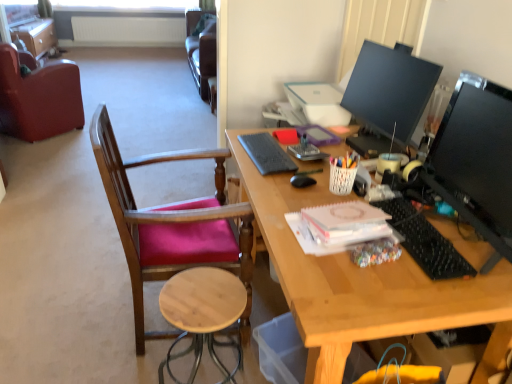
What do you see at coordinates (425, 242) in the screenshot?
I see `black plastic keyboard at right` at bounding box center [425, 242].

Measure the distance between point (409, 241) and camera.

The depth of point (409, 241) is 1.30 meters.

What is the approximate height of wooden chair with pink cushion at left, marked as the 1th chair in a bottom-to-top arrangement?

38.10 inches.

This screenshot has width=512, height=384. I want to click on wooden chair with pink cushion at left, which is counted as the second chair, starting from the left, so click(x=172, y=226).

In order to face black matte mouse at center, should I rotate leftwards or rightwards?

You should look right and rotate roughly 6.553 degrees.

What are the coordinates of `matte brown file cabinet at upper left` in the screenshot? It's located at (36, 36).

This screenshot has height=384, width=512. What do you see at coordinates (346, 223) in the screenshot?
I see `pink paper notepad at center, which ranks as the 2th notepad in top-to-bottom order` at bounding box center [346, 223].

Where is `black plastic keyboard at right`? The height and width of the screenshot is (384, 512). black plastic keyboard at right is located at coordinates (425, 242).

Which object is positioned more to the left, gray matte keyboard at center, the first notepad in the top-to-bottom sequence, or leather at left, marked as the second chair in a bottom-to-top arrangement?

leather at left, marked as the second chair in a bottom-to-top arrangement.

How many degrees apart are the facing directions of gray matte keyboard at center, which appears as the second notepad when ordered from the bottom, and leather at left, which is the 1th chair in top-to-bottom order?

The angular difference between gray matte keyboard at center, which appears as the second notepad when ordered from the bottom, and leather at left, which is the 1th chair in top-to-bottom order, is 137 degrees.

Which of these two, gray matte keyboard at center, the second notepad viewed from the front, or leather at left, the first chair from the back, is thinner?

gray matte keyboard at center, the second notepad viewed from the front.

Between natural wood stool at lower center and black plastic keyboard at right, which one appears on the right side from the viewer's perspective?

black plastic keyboard at right.

From a real-world perspective, who is located lower, natural wood stool at lower center or black plastic keyboard at right?

natural wood stool at lower center, from a real-world perspective.

Are natural wood stool at lower center and black plastic keyboard at right located far from each other?

No, natural wood stool at lower center is in close proximity to black plastic keyboard at right.

Considering the relative sizes of natural wood stool at lower center and black plastic keyboard at right in the image provided, is natural wood stool at lower center wider than black plastic keyboard at right?

Correct, the width of natural wood stool at lower center exceeds that of black plastic keyboard at right.

The height and width of the screenshot is (384, 512). I want to click on mouse that appears above the natural wood stool at lower center (from a real-world perspective), so click(x=302, y=180).

Are black matte mouse at center and natural wood stool at lower center beside each other?

black matte mouse at center is not next to natural wood stool at lower center, and they're not touching.

Is black matte mouse at center aimed at natural wood stool at lower center?

No, black matte mouse at center is not facing towards natural wood stool at lower center.

Consider the image. Is matte black monitor at upper right, placed as the second television when sorted from front to back, touching natural wood stool at lower center?

No, matte black monitor at upper right, placed as the second television when sorted from front to back, is not touching natural wood stool at lower center.

Can you confirm if matte black monitor at upper right, placed as the second television when sorted from front to back, is smaller than natural wood stool at lower center?

Yes, matte black monitor at upper right, placed as the second television when sorted from front to back, is smaller than natural wood stool at lower center.

From a real-world perspective, is matte black monitor at upper right, which is counted as the first television, starting from the back, on top of natural wood stool at lower center?

Yes, from a real-world perspective, matte black monitor at upper right, which is counted as the first television, starting from the back, is over natural wood stool at lower center

Which object is closer to the camera, matte black monitor at upper right, which is counted as the first television, starting from the back, or natural wood stool at lower center?

natural wood stool at lower center is more forward.

Is black plastic keyboard at right shorter than black glossy monitor at right, marked as the 2th television in a back-to-front arrangement?

Correct, black plastic keyboard at right is not as tall as black glossy monitor at right, marked as the 2th television in a back-to-front arrangement.

Where is `the 2nd television counting from the right of the black plastic keyboard at right`? This screenshot has width=512, height=384. the 2nd television counting from the right of the black plastic keyboard at right is located at coordinates (476, 159).

Considering the relative sizes of black plastic keyboard at right and black glossy monitor at right, arranged as the 1th television when viewed from the front, in the image provided, is black plastic keyboard at right smaller than black glossy monitor at right, arranged as the 1th television when viewed from the front,?

Correct, black plastic keyboard at right occupies less space than black glossy monitor at right, arranged as the 1th television when viewed from the front.

From the picture: Measure the distance between black plastic keyboard at right and black glossy monitor at right, marked as the 2th television in a back-to-front arrangement.

black plastic keyboard at right is 8.36 inches from black glossy monitor at right, marked as the 2th television in a back-to-front arrangement.

Measure the distance between leather at left, which is the 1th chair in top-to-bottom order, and natural wood stool at lower center.

leather at left, which is the 1th chair in top-to-bottom order, is 9.40 feet from natural wood stool at lower center.

Is leather at left, which is the 1th chair in top-to-bottom order, positioned with its back to natural wood stool at lower center?

leather at left, which is the 1th chair in top-to-bottom order, is not turned away from natural wood stool at lower center.

Is leather at left, the first chair from the back, further to the viewer compared to natural wood stool at lower center?

Yes, it is behind natural wood stool at lower center.

From the image's perspective, is leather at left, the second chair in the right-to-left sequence, located beneath natural wood stool at lower center?

Incorrect, from the image's perspective, leather at left, the second chair in the right-to-left sequence, is higher than natural wood stool at lower center.

Is black glossy monitor at right, marked as the 2th television in a back-to-front arrangement, shorter than leather at left, arranged as the second chair when viewed from the front?

Yes.

From a real-world perspective, is black glossy monitor at right, marked as the 2th television in a back-to-front arrangement, under leather at left, which is the 1th chair in top-to-bottom order?

No, from a real-world perspective, black glossy monitor at right, marked as the 2th television in a back-to-front arrangement, is not under leather at left, which is the 1th chair in top-to-bottom order.

Is point (506, 100) closer or farther from the camera than point (32, 125)?

Point (506, 100) is closer to the camera than point (32, 125).

I want to click on the 2nd chair behind the black glossy monitor at right, arranged as the 1th television when viewed from the front, so click(38, 98).

I want to click on notepad that is the 1st one above the leather at left, the second chair in the right-to-left sequence (from a real-world perspective), so click(x=267, y=153).

The image size is (512, 384). I want to click on keyboard that is on the right side of natural wood stool at lower center, so click(425, 242).

Consider the image. Based on their spatial positions, is matte brown file cabinet at upper left or black plastic keyboard at right closer to black matte mouse at center?

black plastic keyboard at right.

Based on their spatial positions, is pink paper notepad at center, arranged as the 1th notepad when ordered from the bottom, or black glossy monitor at right, arranged as the 1th television when viewed from the front, closer to natural wood stool at lower center?

pink paper notepad at center, arranged as the 1th notepad when ordered from the bottom, is positioned closer to the anchor natural wood stool at lower center.

Looking at the image, which one is located further to black glossy monitor at right, marked as the 2th television in a back-to-front arrangement, black plastic keyboard at right or gray matte keyboard at center, which appears as the second notepad when ordered from the bottom?

gray matte keyboard at center, which appears as the second notepad when ordered from the bottom, lies further to black glossy monitor at right, marked as the 2th television in a back-to-front arrangement, than the other object.

Looking at the image, which one is located further to wooden chair with pink cushion at left, marked as the 1th chair in a bottom-to-top arrangement, black matte mouse at center or matte black monitor at upper right, which is counted as the first television, starting from the back?

matte black monitor at upper right, which is counted as the first television, starting from the back, is positioned further to the anchor wooden chair with pink cushion at left, marked as the 1th chair in a bottom-to-top arrangement.

Considering their positions, is black plastic keyboard at right positioned further to matte brown file cabinet at upper left than matte black monitor at upper right, placed as the second television when sorted from front to back?

black plastic keyboard at right is further to matte brown file cabinet at upper left.

From the image, which object appears to be farther from black glossy monitor at right, marked as the 2th television in a back-to-front arrangement, gray matte keyboard at center, which appears as the second notepad when ordered from the bottom, or matte black monitor at upper right, placed as the second television when sorted from front to back?

Based on the image, gray matte keyboard at center, which appears as the second notepad when ordered from the bottom, appears to be further to black glossy monitor at right, marked as the 2th television in a back-to-front arrangement.

Based on their spatial positions, is leather at left, the first chair from the back, or black matte mouse at center closer to matte brown file cabinet at upper left?

Among the two, leather at left, the first chair from the back, is located nearer to matte brown file cabinet at upper left.

Based on their spatial positions, is leather at left, arranged as the second chair when viewed from the front, or matte black monitor at upper right, which is counted as the first television, starting from the back, further from pink paper notepad at center, placed as the 1th notepad when sorted from front to back?

The object further to pink paper notepad at center, placed as the 1th notepad when sorted from front to back, is leather at left, arranged as the second chair when viewed from the front.

Where is `mouse between matte black monitor at upper right, placed as the second television when sorted from front to back, and natural wood stool at lower center from top to bottom`? The width and height of the screenshot is (512, 384). mouse between matte black monitor at upper right, placed as the second television when sorted from front to back, and natural wood stool at lower center from top to bottom is located at coordinates (302, 180).

Image resolution: width=512 pixels, height=384 pixels. In order to click on mouse situated between leather at left, marked as the second chair in a bottom-to-top arrangement, and pink paper notepad at center, arranged as the 1th notepad when ordered from the bottom, from left to right in this screenshot , I will do `click(302, 180)`.

Identify the location of chair located between leather at left, the first chair from the back, and natural wood stool at lower center in the left-right direction. This screenshot has height=384, width=512. (172, 226).

Locate an element on the screen. keyboard between gray matte keyboard at center, the second notepad viewed from the front, and natural wood stool at lower center in the up-down direction is located at coordinates (425, 242).